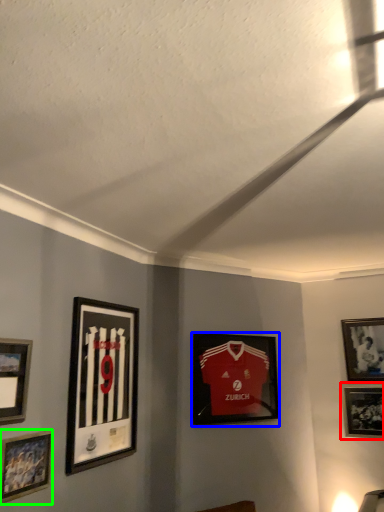
Question: Which is nearer to the picture frame (highlighted by a red box)? picture frame (highlighted by a blue box) or picture frame (highlighted by a green box).

Choices:
 (A) picture frame
 (B) picture frame

Answer: (A)